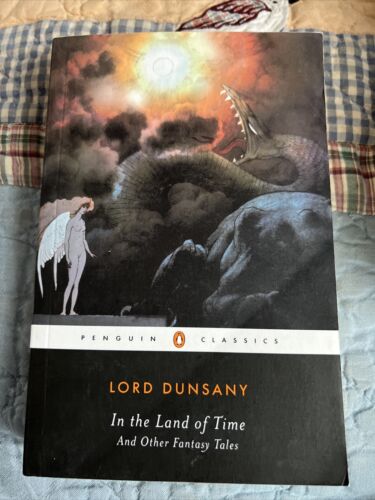
Image resolution: width=375 pixels, height=500 pixels. What are the coordinates of `book` in the screenshot? It's located at (322, 282).